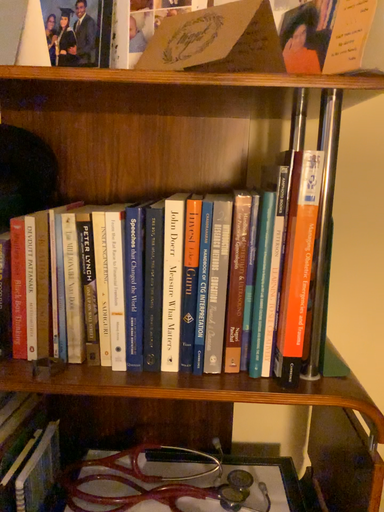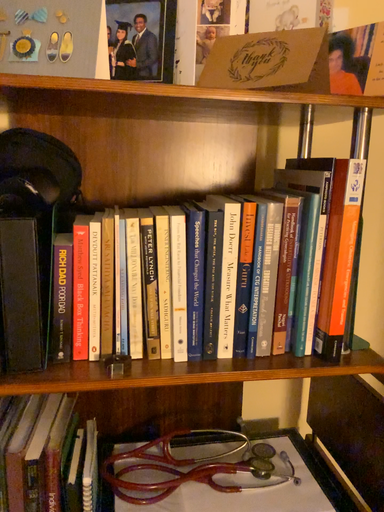
Question: Which way did the camera rotate in the video?

Choices:
 (A) rotated right
 (B) rotated left

Answer: (A)